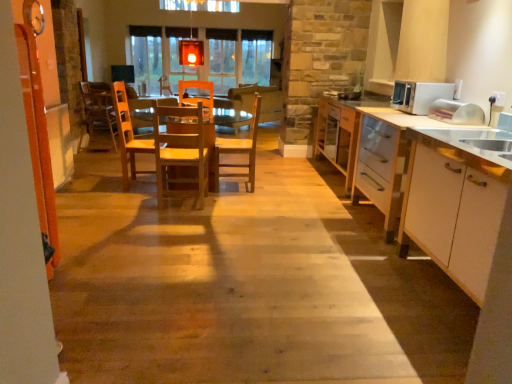
This screenshot has width=512, height=384. What do you see at coordinates (99, 109) in the screenshot? I see `wooden chair at center, the first chair when ordered from left to right` at bounding box center [99, 109].

Describe the element at coordinates (458, 200) in the screenshot. I see `white glossy cabinet at right` at that location.

How much space does wooden chair at center, marked as the third chair in a left-to-right arrangement, occupy horizontally?

The width of wooden chair at center, marked as the third chair in a left-to-right arrangement, is 18.15 inches.

Describe the element at coordinates (240, 149) in the screenshot. The image size is (512, 384). I see `wooden table at center` at that location.

Describe the element at coordinates (216, 289) in the screenshot. I see `wooden floor at center` at that location.

Find the location of a particular element. This screenshot has width=512, height=384. white glossy microwave at right is located at coordinates (419, 95).

Locate an element on the screen. The width and height of the screenshot is (512, 384). light fixture located behind the wooden table at center is located at coordinates (191, 50).

From a real-world perspective, who is located lower, wooden table at center or translucent glass lantern at upper center?

In real-world perspective, wooden table at center is lower.

Is wooden table at center to the right of translucent glass lantern at upper center from the viewer's perspective?

In fact, wooden table at center is to the left of translucent glass lantern at upper center.

Considering the sizes of objects wooden table at center and translucent glass lantern at upper center in the image provided, who is bigger, wooden table at center or translucent glass lantern at upper center?

Bigger between the two is wooden table at center.

Looking at their sizes, would you say wooden chair at center, the first chair when ordered from left to right, is wider or thinner than wooden chair at center, acting as the 2th chair starting from the front?

wooden chair at center, the first chair when ordered from left to right, is wider than wooden chair at center, acting as the 2th chair starting from the front.

Is wooden chair at center, the first chair when ordered from left to right, closer to the viewer compared to wooden chair at center, which appears as the first chair when viewed from the right?

No, it is behind wooden chair at center, which appears as the first chair when viewed from the right.

Is wooden chair at center, the first chair when ordered from left to right, smaller than wooden chair at center, arranged as the second chair when viewed from the back?

No.

Is wooden chair at center, the 3th chair when ordered from front to back, turned away from wooden chair at center, arranged as the second chair when viewed from the back?

No, wooden chair at center, the 3th chair when ordered from front to back,'s orientation is not away from wooden chair at center, arranged as the second chair when viewed from the back.

Who is shorter, wooden floor at center or wooden chair at center, which is counted as the third chair, starting from the right?

wooden floor at center is shorter.

Is wooden floor at center aimed at wooden chair at center, which is counted as the third chair, starting from the right?

No, wooden floor at center is not turned towards wooden chair at center, which is counted as the third chair, starting from the right.

From the picture: Which is more to the right, wooden floor at center or wooden chair at center, the first chair when ordered from left to right?

wooden floor at center.

Locate an element on the screen. The image size is (512, 384). path in front of the wooden chair at center, the first chair in the back-to-front sequence is located at coordinates (216, 289).

Considering the sizes of objects white glossy cabinet at right and wooden table at center in the image provided, who is bigger, white glossy cabinet at right or wooden table at center?

wooden table at center is bigger.

Between white glossy cabinet at right and wooden table at center, which one has less height?

wooden table at center is shorter.

From a real-world perspective, is wooden chair at center, which appears as the first chair when viewed from the right, physically above white glossy microwave at right?

No, from a real-world perspective, wooden chair at center, which appears as the first chair when viewed from the right, is not on top of white glossy microwave at right.

Who is taller, wooden chair at center, acting as the 2th chair starting from the front, or white glossy microwave at right?

wooden chair at center, acting as the 2th chair starting from the front, is taller.

Does point (251, 178) lie behind point (414, 106)?

That is True.

You are a GUI agent. You are given a task and a screenshot of the screen. Output one action in this format:
    pyautogui.click(x=<x>, y=<y>)
    Task: Click on the chair that is the 2nd object directly below the white glossy microwave at right (from a real-world perspective)
    
    Given the screenshot: What is the action you would take?
    pyautogui.click(x=240, y=150)

Considering the sizes of objects wooden chair at center, which is counted as the third chair, starting from the right, and wooden table at center in the image provided, who is smaller, wooden chair at center, which is counted as the third chair, starting from the right, or wooden table at center?

wooden chair at center, which is counted as the third chair, starting from the right.

Is wooden chair at center, which is counted as the third chair, starting from the right, to the right of wooden table at center from the viewer's perspective?

Incorrect, wooden chair at center, which is counted as the third chair, starting from the right, is not on the right side of wooden table at center.

Considering the positions of point (101, 115) and point (228, 142), is point (101, 115) closer or farther from the camera than point (228, 142)?

Point (101, 115) is positioned farther from the camera compared to point (228, 142).

Would you say wooden chair at center, the first chair in the back-to-front sequence, contains wooden table at center?

No.

Which point is more distant from viewer, (423, 82) or (252, 137)?

The point (252, 137) is more distant.

In the scene shown: Considering the sizes of objects white glossy microwave at right and wooden table at center in the image provided, who is taller, white glossy microwave at right or wooden table at center?

With more height is wooden table at center.

You are a GUI agent. You are given a task and a screenshot of the screen. Output one action in this format:
    pyautogui.click(x=<x>, y=<y>)
    Task: Click on the table below the white glossy microwave at right (from the image's perspective)
    The image size is (512, 384).
    Given the screenshot: What is the action you would take?
    pyautogui.click(x=240, y=149)

From a real-world perspective, who is located higher, white glossy microwave at right or wooden table at center?

In real-world perspective, white glossy microwave at right is above.

Locate an element on the screen. Image resolution: width=512 pixels, height=384 pixels. table that appears below the translucent glass lantern at upper center (from the image's perspective) is located at coordinates (240, 149).

Where is `chair behind the wooden chair at center, acting as the 2th chair starting from the front`? chair behind the wooden chair at center, acting as the 2th chair starting from the front is located at coordinates (99, 109).

Based on their spatial positions, is wooden table at center or wooden floor at center further from translucent glass lantern at upper center?

Based on the image, wooden floor at center appears to be further to translucent glass lantern at upper center.

Looking at the image, which one is located further to wooden floor at center, wooden table at center or white glossy cabinet at right?

wooden table at center is positioned further to the anchor wooden floor at center.

Considering their positions, is white glossy microwave at right positioned further to white glossy cabinet at right than wooden floor at center?

Among the two, wooden floor at center is located further to white glossy cabinet at right.

Considering their positions, is wooden chair at center, the first chair in the back-to-front sequence, positioned closer to wooden chair at center, arranged as the second chair when viewed from the back, than translucent glass lantern at upper center?

translucent glass lantern at upper center is positioned closer to the anchor wooden chair at center, arranged as the second chair when viewed from the back.

Considering their positions, is wooden chair at center, which ranks as the 1th chair in front-to-back order, positioned further to wooden chair at center, acting as the 2th chair starting from the front, than translucent glass lantern at upper center?

translucent glass lantern at upper center.

From the image, which object appears to be farther from wooden table at center, wooden floor at center or white glossy cabinet at right?

white glossy cabinet at right.

Estimate the real-world distances between objects in this image. Which object is closer to white glossy cabinet at right, wooden chair at center, the 3th chair when ordered from front to back, or wooden floor at center?

wooden floor at center lies closer to white glossy cabinet at right than the other object.

Estimate the real-world distances between objects in this image. Which object is closer to white glossy microwave at right, wooden chair at center, which ranks as the 1th chair in front-to-back order, or wooden chair at center, acting as the 2th chair starting from the front?

The object closer to white glossy microwave at right is wooden chair at center, acting as the 2th chair starting from the front.

You are a GUI agent. You are given a task and a screenshot of the screen. Output one action in this format:
    pyautogui.click(x=<x>, y=<y>)
    Task: Click on the table between wooden floor at center and translucent glass lantern at upper center from front to back
    The image size is (512, 384).
    Given the screenshot: What is the action you would take?
    pyautogui.click(x=240, y=149)

Identify the location of path positioned between white glossy cabinet at right and translucent glass lantern at upper center from near to far. This screenshot has height=384, width=512. (216, 289).

Where is `appliance between white glossy cabinet at right and wooden chair at center, arranged as the second chair when viewed from the back, along the z-axis`? The width and height of the screenshot is (512, 384). appliance between white glossy cabinet at right and wooden chair at center, arranged as the second chair when viewed from the back, along the z-axis is located at coordinates (419, 95).

Locate an element on the screen. Image resolution: width=512 pixels, height=384 pixels. path between white glossy cabinet at right and wooden table at center from front to back is located at coordinates (216, 289).